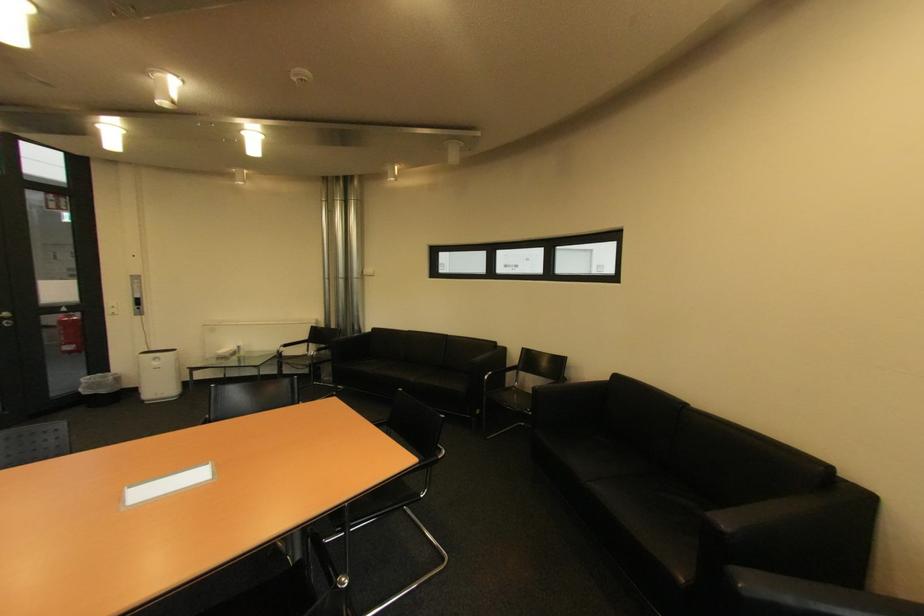
This screenshot has width=924, height=616. What do you see at coordinates (69, 331) in the screenshot?
I see `the red fire extinguisher` at bounding box center [69, 331].